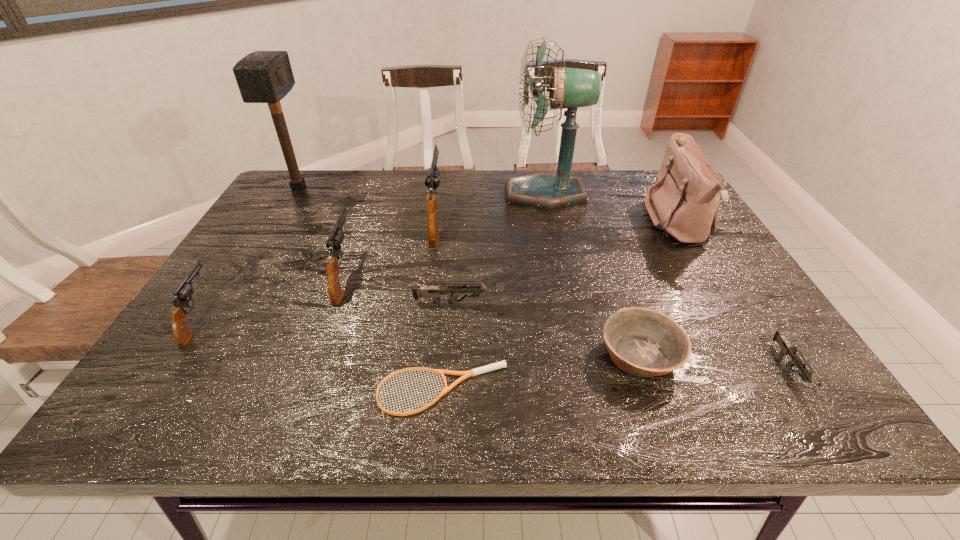
I want to click on gun located in the near edge section of the desktop, so click(786, 349).

The image size is (960, 540). Identify the location of tennis racket that is at the near edge. (502, 364).

Where is `mallet present at the left edge`? mallet present at the left edge is located at coordinates (262, 76).

Where is `gun located at the left edge`? This screenshot has width=960, height=540. gun located at the left edge is located at coordinates (183, 294).

Where is `shoulder bag that is at the right edge`? The width and height of the screenshot is (960, 540). shoulder bag that is at the right edge is located at coordinates (684, 203).

Find the location of a particular element. The image size is (960, 540). gun positioned at the right edge is located at coordinates (786, 349).

The image size is (960, 540). What are the coordinates of `object present at the far left corner` in the screenshot? It's located at point(262,76).

Image resolution: width=960 pixels, height=540 pixels. I want to click on object that is positioned at the far right corner, so click(684, 203).

In order to click on object that is at the near right corner in this screenshot , I will do `click(786, 349)`.

Where is `vacant point at the far edge`? This screenshot has height=540, width=960. vacant point at the far edge is located at coordinates (464, 191).